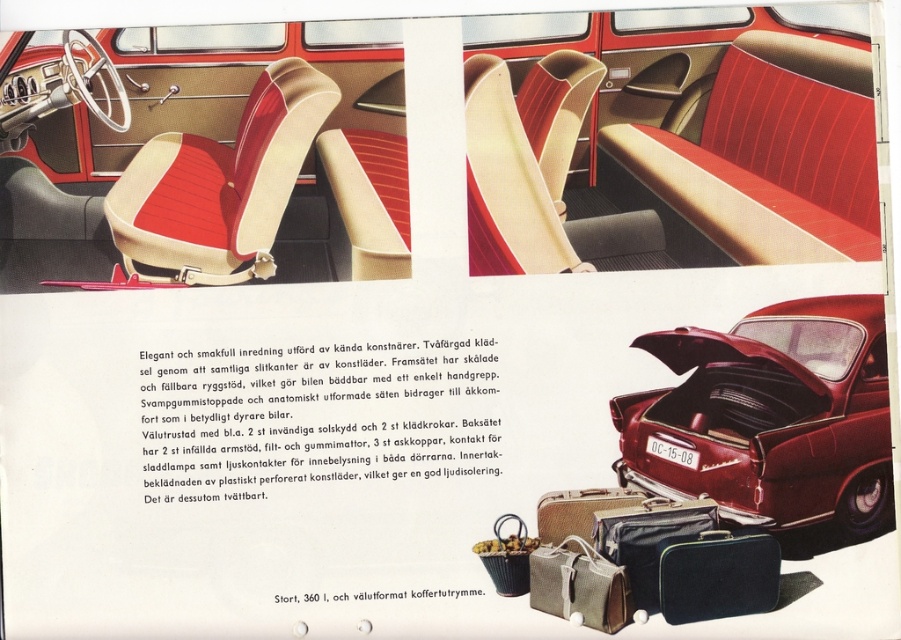
You are a passenger in the car and want to retrieve your matte black suitcase at lower right and leather suitcase at lower center from the trunk. Which one should you reach for first?

The matte black suitcase at lower right is closer to the viewer than the leather suitcase at lower center, so you should reach for the matte black suitcase at lower right first.

You are a travel agent helping a client pack for a trip. The client has a matte black suitcase at lower right and a leather suitcase at lower center. Which suitcase should they choose if they need more vertical space for clothes?

The matte black suitcase at lower right is much taller than the leather suitcase at lower center, so they should choose the matte black suitcase at lower right for more vertical space.

You are standing in front of the car shown in the image. There is a point at coordinates point (770,417). Where is this point located on the car?

The point (770,417) is located on the shiny red car trunk at lower right.